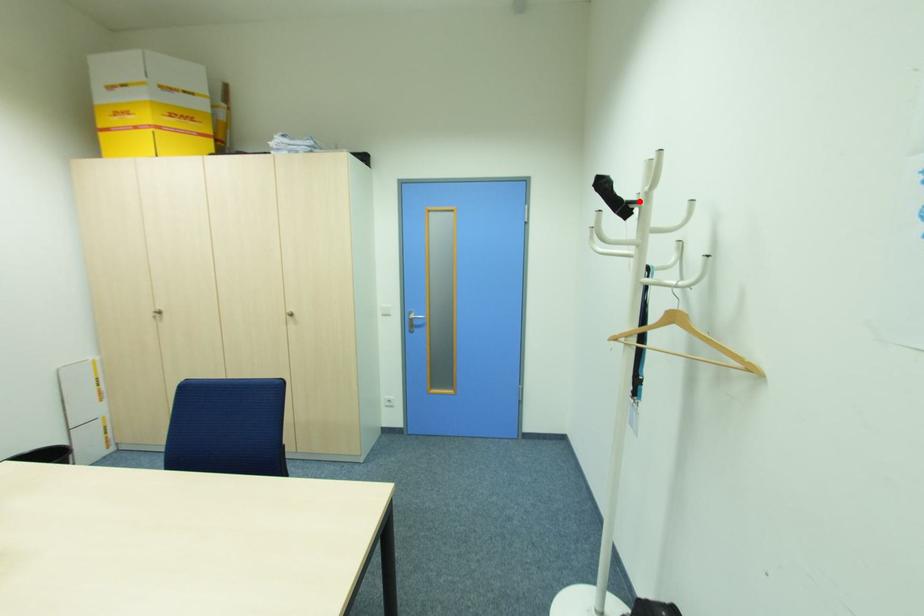
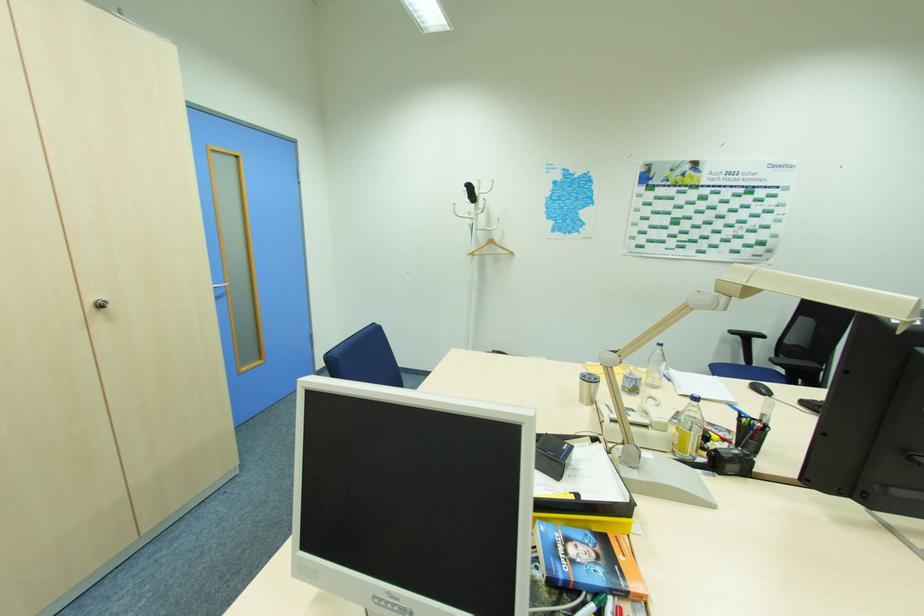
Find the pixel in the second image that matches the highlighted location in the first image.

(479, 197)